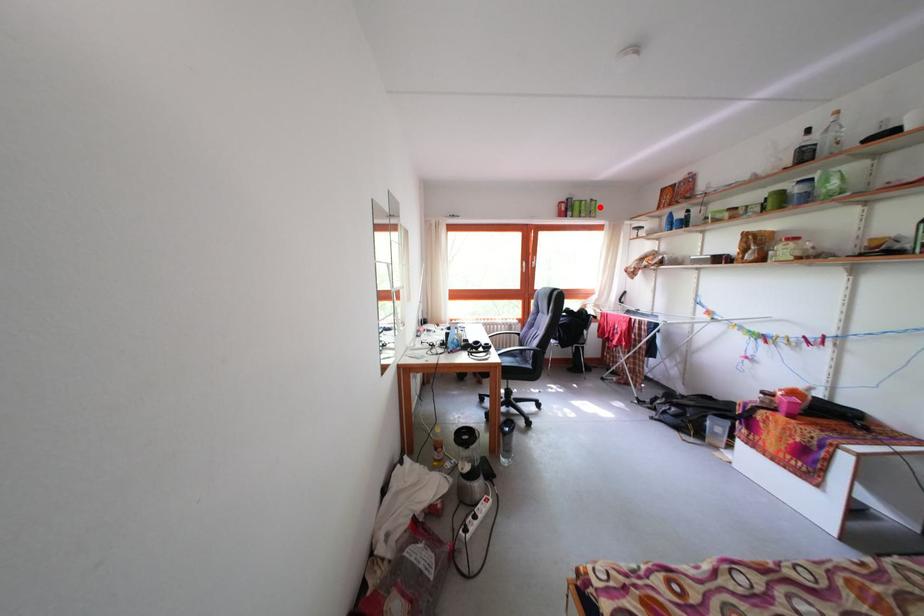
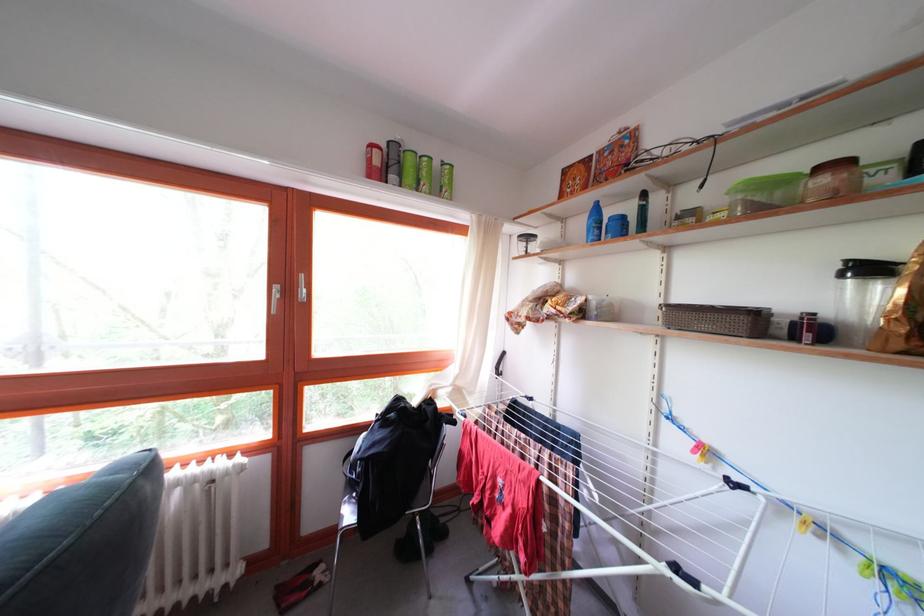
Where in the second image is the point corresponding to the highlighted location from the first image?

(452, 169)